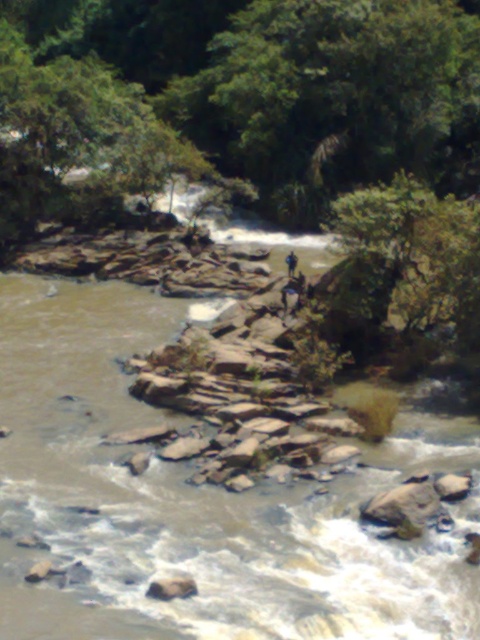
You are standing at the origin point of the coordinate system in the image. You want to move towards the brown rough rock at lower left. What are the coordinates you need to move to reach it?

The coordinates to reach the brown rough rock at lower left are at point (171, 588).

You are standing on the riverbank and see the brown rough rock at lower left and the dark blue jeans at center. Which object is taller?

The dark blue jeans at center is taller than the brown rough rock at lower left.